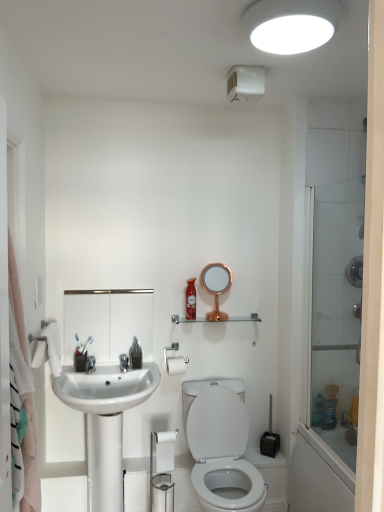
The width and height of the screenshot is (384, 512). What do you see at coordinates (191, 300) in the screenshot? I see `matte glass bottle at center` at bounding box center [191, 300].

Measure the distance between point (55, 362) and camera.

A distance of 7.57 feet exists between point (55, 362) and camera.

You are a GUI agent. You are given a task and a screenshot of the screen. Output one action in this format:
    pyautogui.click(x=<x>, y=<y>)
    Task: Click on the white glossy toilet at lower center
    
    Given the screenshot: What is the action you would take?
    pyautogui.click(x=222, y=453)

The height and width of the screenshot is (512, 384). I want to click on transparent glass shower door at right, so click(x=336, y=310).

What do you see at coordinates (174, 360) in the screenshot?
I see `white matte toilet paper at center, positioned as the 2th toilet paper in bottom-to-top order` at bounding box center [174, 360].

Identify the location of clear glass shelf at center. (217, 320).

Identify the location of gold metallic mirror at center. The height and width of the screenshot is (512, 384). (216, 286).

From a real-world perspective, who is located higher, white soft towel at left or white glossy medicine cabinet at upper center?

In real-world perspective, white glossy medicine cabinet at upper center is above.

Is point (38, 362) positioned in front of point (137, 317)?

Yes, point (38, 362) is closer to viewer.

Is white soft towel at left far away from white glossy medicine cabinet at upper center?

white soft towel at left is actually quite close to white glossy medicine cabinet at upper center.

Which is more to the right, white soft towel at left or gold metallic mirror at center?

gold metallic mirror at center.

Between white soft towel at left and gold metallic mirror at center, which one has less height?

Standing shorter between the two is white soft towel at left.

Is white soft towel at left looking in the opposite direction of gold metallic mirror at center?

white soft towel at left is not turned away from gold metallic mirror at center.

Considering the relative sizes of white soft towel at left and gold metallic mirror at center in the image provided, is white soft towel at left wider than gold metallic mirror at center?

Yes.

Is point (145, 328) closer to viewer compared to point (215, 422)?

No, it is not.

Is white glossy medicine cabinet at upper center surrounding white glossy toilet at lower center?

No, white glossy medicine cabinet at upper center does not contain white glossy toilet at lower center.

Is white glossy medicine cabinet at upper center oriented towards white glossy toilet at lower center?

No, white glossy medicine cabinet at upper center is not aimed at white glossy toilet at lower center.

Can you tell me how much white glossy medicine cabinet at upper center and white glossy toilet at lower center differ in facing direction?

The angular difference between white glossy medicine cabinet at upper center and white glossy toilet at lower center is 0.127 degrees.

From the image's perspective, would you say white fabric shower curtain at left is shown under white soft towel at left?

No.

Considering the sizes of objects white fabric shower curtain at left and white soft towel at left in the image provided, who is shorter, white fabric shower curtain at left or white soft towel at left?

With less height is white soft towel at left.

Looking at this image, how many degrees apart are the facing directions of white fabric shower curtain at left and white soft towel at left?

They differ by 0.829 degrees in their facing directions.

Locate an element on the screen. shower curtain in front of the white soft towel at left is located at coordinates (30, 460).

Between gold metallic mirror at center and matte glass bottle at center, which one appears on the right side from the viewer's perspective?

From the viewer's perspective, gold metallic mirror at center appears more on the right side.

Is gold metallic mirror at center facing towards matte glass bottle at center?

No.

The height and width of the screenshot is (512, 384). I want to click on mirror above the matte glass bottle at center (from the image's perspective), so click(216, 286).

Is gold metallic mirror at center located outside matte glass bottle at center?

Yes, gold metallic mirror at center is not within matte glass bottle at center.

Between white matte light fixture at upper center and gold metallic mirror at center, which one appears on the right side from the viewer's perspective?

white matte light fixture at upper center is more to the right.

Considering the positions of objects white matte light fixture at upper center and gold metallic mirror at center in the image provided, who is behind, white matte light fixture at upper center or gold metallic mirror at center?

gold metallic mirror at center is behind.

Based on the photo, which point is more distant from viewer, (268, 8) or (217, 312)?

The point (217, 312) is more distant.

Is white matte light fixture at upper center wider or thinner than gold metallic mirror at center?

Considering their sizes, white matte light fixture at upper center looks broader than gold metallic mirror at center.

Which object is closer to the camera taking this photo, matte glass bottle at center or white glossy medicine cabinet at upper center?

white glossy medicine cabinet at upper center is closer to the camera.

Based on the photo, considering the relative sizes of matte glass bottle at center and white glossy medicine cabinet at upper center in the image provided, is matte glass bottle at center bigger than white glossy medicine cabinet at upper center?

No, matte glass bottle at center is not bigger than white glossy medicine cabinet at upper center.

Is point (189, 291) farther from viewer compared to point (122, 323)?

Yes, it is behind point (122, 323).

Is matte glass bottle at center turned away from white glossy medicine cabinet at upper center?

No, matte glass bottle at center is not facing away from white glossy medicine cabinet at upper center.

Locate an element on the screen. This screenshot has width=384, height=512. medicine cabinet on the right of white soft towel at left is located at coordinates (109, 321).

Where is `mirror above the white soft towel at left (from the image's perspective)`? mirror above the white soft towel at left (from the image's perspective) is located at coordinates click(x=216, y=286).

Which object lies nearer to the anchor point white glossy toilet at lower center, white fabric shower curtain at left or white matte toilet paper at center, which appears as the 2th toilet paper when viewed from the front?

white matte toilet paper at center, which appears as the 2th toilet paper when viewed from the front.

Based on their spatial positions, is clear glass shelf at center or white matte toilet paper at center, the first toilet paper viewed from the back, further from white matte toilet paper at lower center, which is the 1th toilet paper from front to back?

Among the two, clear glass shelf at center is located further to white matte toilet paper at lower center, which is the 1th toilet paper from front to back.

Estimate the real-world distances between objects in this image. Which object is further from white matte toilet paper at center, which appears as the 2th toilet paper when viewed from the front, white glossy toilet at lower center or white glossy medicine cabinet at upper center?

white glossy toilet at lower center is further to white matte toilet paper at center, which appears as the 2th toilet paper when viewed from the front.

Based on the photo, which object lies nearer to the anchor point white matte toilet paper at center, which appears as the 2th toilet paper when viewed from the front, gold metallic mirror at center or white soft towel at left?

gold metallic mirror at center is closer to white matte toilet paper at center, which appears as the 2th toilet paper when viewed from the front.

Looking at the image, which one is located closer to white fabric shower curtain at left, white glossy sink at center or white matte toilet paper at center, the first toilet paper viewed from the back?

The object closer to white fabric shower curtain at left is white glossy sink at center.

In the scene shown: Looking at the image, which one is located closer to white soft towel at left, transparent glass shower door at right or white matte light fixture at upper center?

The object closer to white soft towel at left is transparent glass shower door at right.

Looking at this image, when comparing their distances from white matte light fixture at upper center, does white fabric shower curtain at left or white glossy sink at center seem further?

Based on the image, white glossy sink at center appears to be further to white matte light fixture at upper center.

Which object lies further to the anchor point white matte toilet paper at center, positioned as the 2th toilet paper in bottom-to-top order, gold metallic mirror at center or white glossy medicine cabinet at upper center?

gold metallic mirror at center.

Where is `glass door between white matte light fixture at upper center and white matte toilet paper at lower center, positioned as the second toilet paper in top-to-bottom order, from top to bottom`? This screenshot has height=512, width=384. glass door between white matte light fixture at upper center and white matte toilet paper at lower center, positioned as the second toilet paper in top-to-bottom order, from top to bottom is located at coordinates (336, 310).

Locate an element on the screen. Image resolution: width=384 pixels, height=512 pixels. toiletry between white glossy sink at center and transparent glass shower door at right in the horizontal direction is located at coordinates (191, 300).

Where is `bath towel between white fabric shower curtain at left and white matte toilet paper at center, the first toilet paper viewed from the back, along the z-axis`? bath towel between white fabric shower curtain at left and white matte toilet paper at center, the first toilet paper viewed from the back, along the z-axis is located at coordinates point(49,349).

Identify the location of sink located between white glossy medicine cabinet at upper center and transparent glass shower door at right in the left-right direction. Image resolution: width=384 pixels, height=512 pixels. (105, 422).